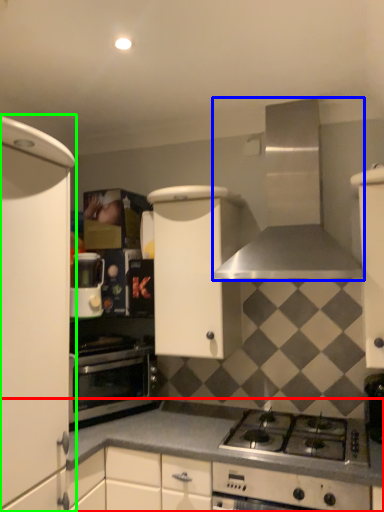
Question: Estimate the real-world distances between objects in this image. Which object is closer to countertop (highlighted by a red box), kitchen appliance (highlighted by a blue box) or cabinetry (highlighted by a green box)?

Choices:
 (A) kitchen appliance
 (B) cabinetry

Answer: (B)